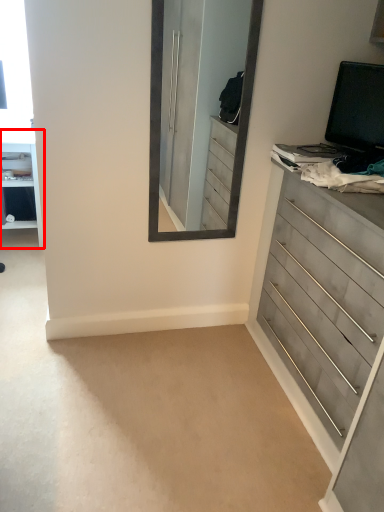
Question: Observing the image, what is the correct spatial positioning of vanity (annotated by the red box) in reference to chest of drawers?

Choices:
 (A) right
 (B) left

Answer: (B)